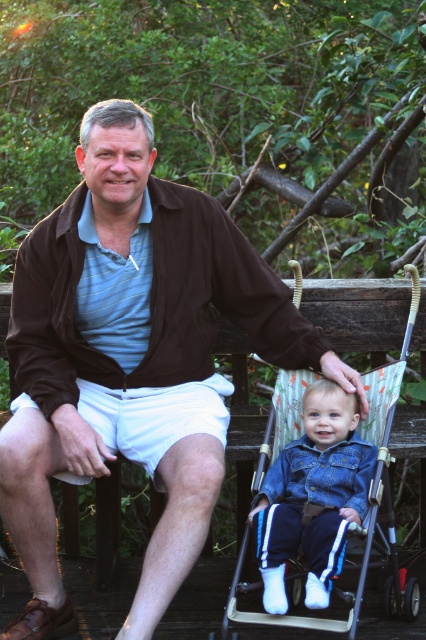
You are a photographer standing 3 meters away from the denim fabric stroller at lower center. Can you adjust your position to get a closer shot without moving the stroller? Explain why or why not.

The denim fabric stroller at lower center is 2.85 meters from the camera. Since you are already standing 3 meters away from it, you cannot get closer without moving the stroller because you are already at a distance greater than the stroller is from the camera.

You are a photographer positioned to the left of the scene. You want to take a photo of the denim jacket at center and the denim fabric stroller at lower center. Which object should you move closer to the right side to ensure both are centered in your frame?

The denim jacket at center should be moved to the right side because it is currently to the left of the denim fabric stroller at lower center, so shifting it right would help center both objects in the frame.

You are standing in the park and see the matte brown jacket at center. If you want to take a photo of it with your phone camera, which has a minimum focus distance of 10 feet, will you be able to capture it clearly?

The matte brown jacket at center is 9.95 feet away from the camera. Since the minimum focus distance is 10 feet, the phone camera cannot focus clearly at distances closer than 10 feet. Therefore, the jacket is just slightly too close to be captured clearly.